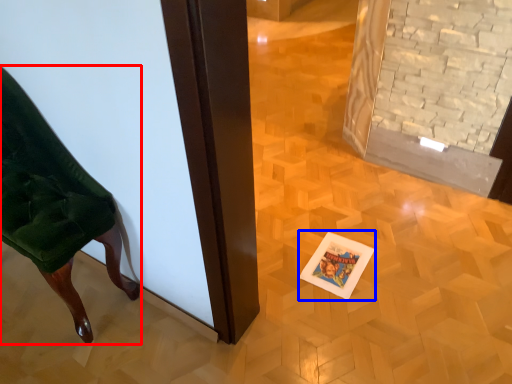
Question: Which object is closer to the camera taking this photo, furniture (highlighted by a red box) or postcard (highlighted by a blue box)?

Choices:
 (A) furniture
 (B) postcard

Answer: (A)